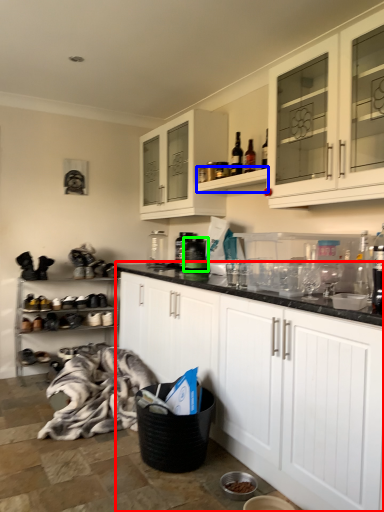
Question: Based on their relative distances, which object is farther from cabinetry (highlighted by a red box)? Choose from shelf (highlighted by a blue box) and appliance (highlighted by a green box).

Choices:
 (A) shelf
 (B) appliance

Answer: (B)